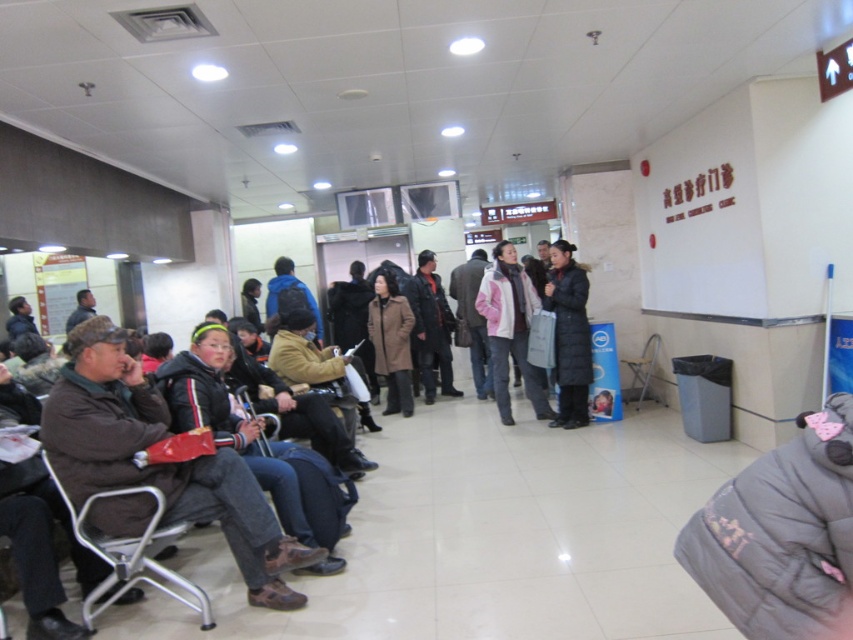
Is brown wool coat at center smaller than metallic gray chair at lower left?

Actually, brown wool coat at center might be larger than metallic gray chair at lower left.

Is brown wool coat at center below metallic gray chair at lower left?

No, brown wool coat at center is not below metallic gray chair at lower left.

Between point (407, 408) and point (256, 440), which one is positioned behind?

Positioned behind is point (407, 408).

This screenshot has height=640, width=853. I want to click on brown wool coat at center, so click(x=392, y=340).

Looking at this image, is metallic gray chair at center above metallic gray chair at lower left?

Yes, metallic gray chair at center is above metallic gray chair at lower left.

Between point (636, 385) and point (247, 392), which one is positioned in front?

Point (247, 392)

Is point (633, 385) behind point (254, 417)?

Yes.

Locate an element on the screen. metallic gray chair at center is located at coordinates (641, 369).

Is silver metallic chair at lower left thinner than pink matte jacket at center?

Indeed, silver metallic chair at lower left has a lesser width compared to pink matte jacket at center.

Between silver metallic chair at lower left and pink matte jacket at center, which one appears on the left side from the viewer's perspective?

silver metallic chair at lower left

Is point (115, 577) farther from viewer compared to point (502, 312)?

No, it is in front of (502, 312).

I want to click on silver metallic chair at lower left, so click(x=131, y=550).